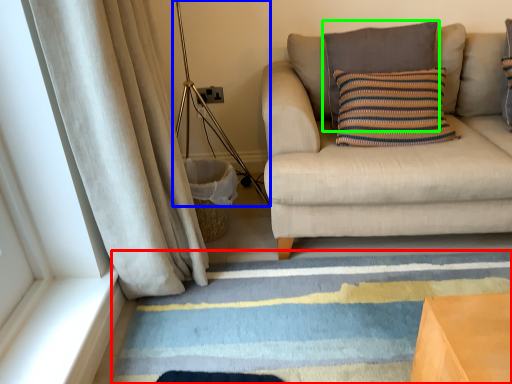
Question: Considering the real-world distances, which object is closest to doormat (highlighted by a red box)? lamp (highlighted by a blue box) or pillow (highlighted by a green box).

Choices:
 (A) lamp
 (B) pillow

Answer: (A)